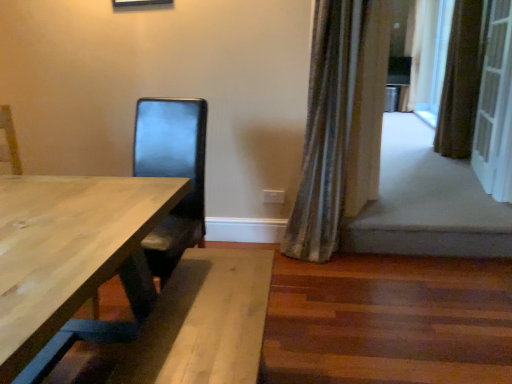
What do you see at coordinates (337, 117) in the screenshot? I see `silky green curtain at right, which ranks as the third curtain in back-to-front order` at bounding box center [337, 117].

This screenshot has width=512, height=384. What do you see at coordinates (413, 53) in the screenshot?
I see `silky beige curtain at upper right, marked as the 3th curtain in a left-to-right arrangement` at bounding box center [413, 53].

Locate an element on the screen. The image size is (512, 384). silky green curtain at right, which ranks as the third curtain in back-to-front order is located at coordinates (337, 117).

From a real-world perspective, does silky beige curtain at upper right, marked as the 3th curtain in a front-to-back arrangement, sit lower than silky green curtain at right, which is counted as the first curtain, starting from the left?

No.

This screenshot has height=384, width=512. I want to click on the 2nd curtain positioned above the silky green curtain at right, which is counted as the first curtain, starting from the left (from a real-world perspective), so click(413, 53).

Is silky beige curtain at upper right, which appears as the 1th curtain when viewed from the right, facing away from silky green curtain at right, the third curtain viewed from the right?

No, silky green curtain at right, the third curtain viewed from the right, is not at the back of silky beige curtain at upper right, which appears as the 1th curtain when viewed from the right.

From the image's perspective, is silky beige curtain at upper right, marked as the 3th curtain in a front-to-back arrangement, above or below silky green curtain at right, which ranks as the third curtain in back-to-front order?

silky beige curtain at upper right, marked as the 3th curtain in a front-to-back arrangement, is above silky green curtain at right, which ranks as the third curtain in back-to-front order.

Which object is thinner, silky green curtain at right, which ranks as the third curtain in back-to-front order, or white textured screen door at right?

Thinner between the two is white textured screen door at right.

From the image's perspective, who appears lower, silky green curtain at right, which is counted as the first curtain, starting from the left, or white textured screen door at right?

silky green curtain at right, which is counted as the first curtain, starting from the left, appears lower in the image.

Considering the relative positions of silky green curtain at right, which ranks as the third curtain in back-to-front order, and white textured screen door at right in the image provided, is silky green curtain at right, which ranks as the third curtain in back-to-front order, in front of white textured screen door at right?

Yes, the depth of silky green curtain at right, which ranks as the third curtain in back-to-front order, is less than that of white textured screen door at right.

How much distance is there between silky green curtain at right, which is counted as the first curtain, starting from the left, and white textured screen door at right?

The distance of silky green curtain at right, which is counted as the first curtain, starting from the left, from white textured screen door at right is 1.19 meters.

Could you tell me if silky green curtain at right, the 1th curtain positioned from the front, is turned towards silky beige curtain at upper right, which appears as the 1th curtain when viewed from the right?

No, silky green curtain at right, the 1th curtain positioned from the front, is not facing towards silky beige curtain at upper right, which appears as the 1th curtain when viewed from the right.

Locate an element on the screen. the 2nd curtain in front of the silky beige curtain at upper right, which appears as the 1th curtain when viewed from the right, counting from the anchor's position is located at coordinates (337, 117).

From the image's perspective, is silky green curtain at right, the 1th curtain positioned from the front, located beneath silky beige curtain at upper right, marked as the 3th curtain in a front-to-back arrangement?

Yes.

Is silky green curtain at right, the third curtain viewed from the right, touching silky beige curtain at upper right, which appears as the 1th curtain when viewed from the right?

They are not placed beside each other.

Considering the sizes of objects brown textured curtain at right, the 2th curtain when ordered from back to front, and silky green curtain at right, the 1th curtain positioned from the front, in the image provided, who is wider, brown textured curtain at right, the 2th curtain when ordered from back to front, or silky green curtain at right, the 1th curtain positioned from the front,?

brown textured curtain at right, the 2th curtain when ordered from back to front.

From the image's perspective, is brown textured curtain at right, the 2th curtain when ordered from back to front, under silky green curtain at right, the third curtain viewed from the right?

Actually, brown textured curtain at right, the 2th curtain when ordered from back to front, appears above silky green curtain at right, the third curtain viewed from the right, in the image.

From a real-world perspective, which curtain is the 1st one above the silky green curtain at right, the 1th curtain positioned from the front? Please provide its 2D coordinates.

[(460, 82)]

Could you tell me if brown textured curtain at right, which is the 2th curtain in front-to-back order, is facing silky green curtain at right, the 1th curtain positioned from the front?

No, brown textured curtain at right, which is the 2th curtain in front-to-back order, is not facing towards silky green curtain at right, the 1th curtain positioned from the front.

In terms of size, does white textured screen door at right appear bigger or smaller than brown textured curtain at right, which is the 2th curtain in front-to-back order?

In the image, white textured screen door at right appears to be smaller than brown textured curtain at right, which is the 2th curtain in front-to-back order.

Considering the relative positions of white textured screen door at right and brown textured curtain at right, which is the 2th curtain in front-to-back order, in the image provided, is white textured screen door at right to the right of brown textured curtain at right, which is the 2th curtain in front-to-back order, from the viewer's perspective?

No, white textured screen door at right is not to the right of brown textured curtain at right, which is the 2th curtain in front-to-back order.

From a real-world perspective, which curtain is the 1st one above the white textured screen door at right? Please provide its 2D coordinates.

[(460, 82)]

In the scene shown: Measure the distance between white textured screen door at right and brown textured curtain at right, placed as the 2th curtain when sorted from right to left.

A distance of 21.87 inches exists between white textured screen door at right and brown textured curtain at right, placed as the 2th curtain when sorted from right to left.

From the image's perspective, is white textured screen door at right located above silky green curtain at right, the third curtain viewed from the right?

Indeed, from the image's perspective, white textured screen door at right is shown above silky green curtain at right, the third curtain viewed from the right.

Which is in front, point (506, 48) or point (356, 145)?

The point (356, 145) is in front.

Does white textured screen door at right have a greater width compared to silky green curtain at right, the third curtain viewed from the right?

No.

Which is more to the left, white textured screen door at right or silky green curtain at right, which is counted as the first curtain, starting from the left?

silky green curtain at right, which is counted as the first curtain, starting from the left, is more to the left.

Who is taller, brown textured curtain at right, marked as the second curtain in a left-to-right arrangement, or white textured screen door at right?

brown textured curtain at right, marked as the second curtain in a left-to-right arrangement, is taller.

From a real-world perspective, is brown textured curtain at right, marked as the second curtain in a left-to-right arrangement, positioned above or below white textured screen door at right?

From a real-world perspective, brown textured curtain at right, marked as the second curtain in a left-to-right arrangement, is physically above white textured screen door at right.

Is white textured screen door at right surrounded by brown textured curtain at right, placed as the 2th curtain when sorted from right to left?

No, white textured screen door at right is not a part of brown textured curtain at right, placed as the 2th curtain when sorted from right to left.

This screenshot has height=384, width=512. What are the coordinates of `curtain that is the 2nd object located behind the silky green curtain at right, which ranks as the third curtain in back-to-front order` in the screenshot? It's located at point(413,53).

Where is `curtain below the white textured screen door at right (from a real-world perspective)`? The width and height of the screenshot is (512, 384). curtain below the white textured screen door at right (from a real-world perspective) is located at coordinates (337, 117).

From the image, which object appears to be farther from silky green curtain at right, which ranks as the third curtain in back-to-front order, white textured screen door at right or brown textured curtain at right, which is the 2th curtain in front-to-back order?

brown textured curtain at right, which is the 2th curtain in front-to-back order.

From the image, which object appears to be nearer to silky beige curtain at upper right, marked as the 3th curtain in a left-to-right arrangement, white textured screen door at right or brown textured curtain at right, placed as the 2th curtain when sorted from right to left?

Based on the image, brown textured curtain at right, placed as the 2th curtain when sorted from right to left, appears to be nearer to silky beige curtain at upper right, marked as the 3th curtain in a left-to-right arrangement.

Considering their positions, is brown textured curtain at right, placed as the 2th curtain when sorted from right to left, positioned further to silky green curtain at right, which ranks as the third curtain in back-to-front order, than white textured screen door at right?

The object further to silky green curtain at right, which ranks as the third curtain in back-to-front order, is brown textured curtain at right, placed as the 2th curtain when sorted from right to left.

Considering their positions, is silky green curtain at right, the 1th curtain positioned from the front, positioned further to white textured screen door at right than silky beige curtain at upper right, marked as the 3th curtain in a left-to-right arrangement?

silky beige curtain at upper right, marked as the 3th curtain in a left-to-right arrangement, is further to white textured screen door at right.

Looking at the image, which one is located closer to white textured screen door at right, silky green curtain at right, which is counted as the first curtain, starting from the left, or brown textured curtain at right, which is the 2th curtain in front-to-back order?

Based on the image, brown textured curtain at right, which is the 2th curtain in front-to-back order, appears to be nearer to white textured screen door at right.

Estimate the real-world distances between objects in this image. Which object is further from silky beige curtain at upper right, which appears as the 1th curtain when viewed from the right, brown textured curtain at right, which is the 2th curtain in front-to-back order, or silky green curtain at right, which ranks as the third curtain in back-to-front order?

The object further to silky beige curtain at upper right, which appears as the 1th curtain when viewed from the right, is silky green curtain at right, which ranks as the third curtain in back-to-front order.

When comparing their distances from silky beige curtain at upper right, the first curtain positioned from the back, does silky green curtain at right, the third curtain viewed from the right, or brown textured curtain at right, placed as the 2th curtain when sorted from right to left, seem closer?

brown textured curtain at right, placed as the 2th curtain when sorted from right to left, lies closer to silky beige curtain at upper right, the first curtain positioned from the back, than the other object.

From the picture: Which object lies nearer to the anchor point silky green curtain at right, the 1th curtain positioned from the front, white textured screen door at right or silky beige curtain at upper right, marked as the 3th curtain in a left-to-right arrangement?

white textured screen door at right lies closer to silky green curtain at right, the 1th curtain positioned from the front, than the other object.

Identify the location of curtain between white textured screen door at right and silky beige curtain at upper right, which appears as the 1th curtain when viewed from the right, along the z-axis. The height and width of the screenshot is (384, 512). (460, 82).

Identify the location of screen door positioned between silky green curtain at right, which ranks as the third curtain in back-to-front order, and silky beige curtain at upper right, which appears as the 1th curtain when viewed from the right, from near to far. (495, 107).

Locate an element on the screen. The height and width of the screenshot is (384, 512). screen door between silky green curtain at right, which is counted as the first curtain, starting from the left, and brown textured curtain at right, marked as the second curtain in a left-to-right arrangement is located at coordinates (495, 107).

Where is `curtain between silky green curtain at right, the 1th curtain positioned from the front, and silky beige curtain at upper right, which appears as the 1th curtain when viewed from the right, from front to back`? The width and height of the screenshot is (512, 384). curtain between silky green curtain at right, the 1th curtain positioned from the front, and silky beige curtain at upper right, which appears as the 1th curtain when viewed from the right, from front to back is located at coordinates (460, 82).